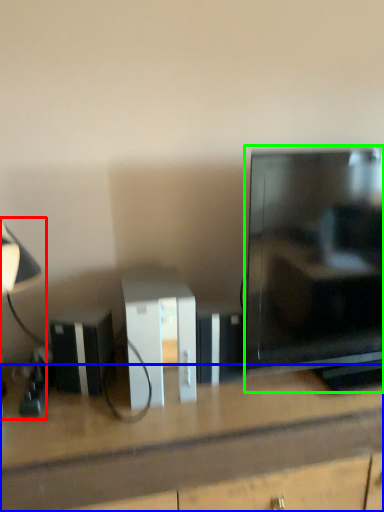
Question: Which object is the closest to the table lamp (highlighted by a red box)? Choose among these: desk (highlighted by a blue box) or television (highlighted by a green box).

Choices:
 (A) desk
 (B) television

Answer: (A)